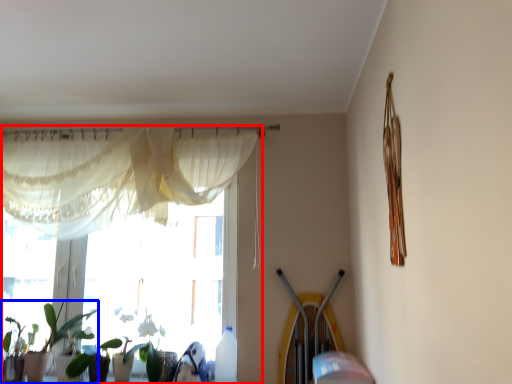
Question: Among these objects, which one is farthest to the camera, window (highlighted by a red box) or houseplant (highlighted by a blue box)?

Choices:
 (A) window
 (B) houseplant

Answer: (A)